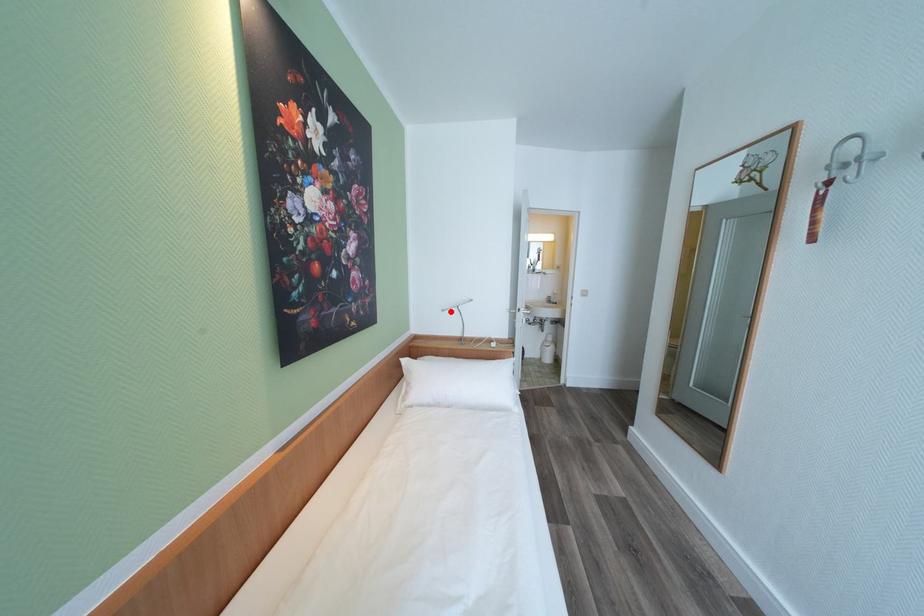
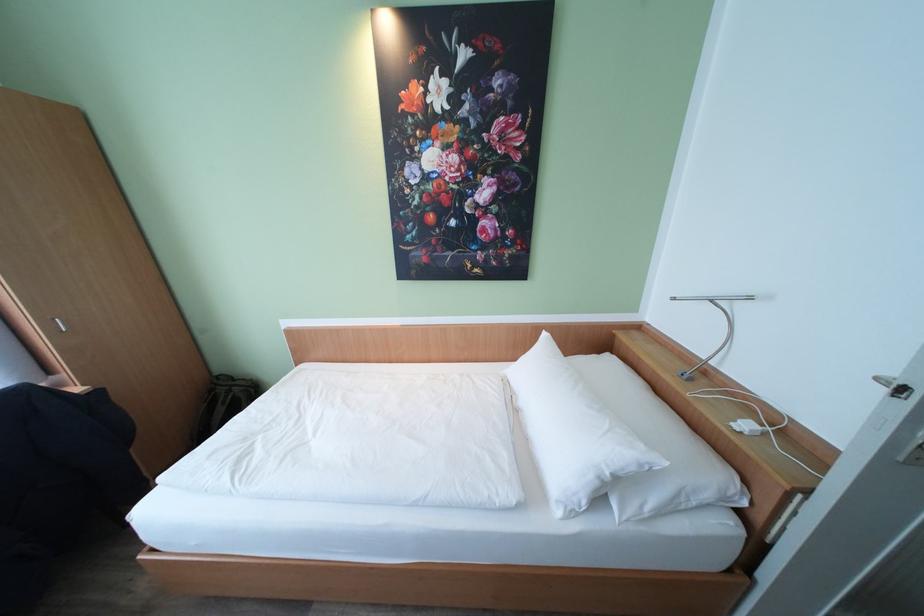
Where in the second image is the point corresponding to the highlighted location from the first image?

(681, 300)